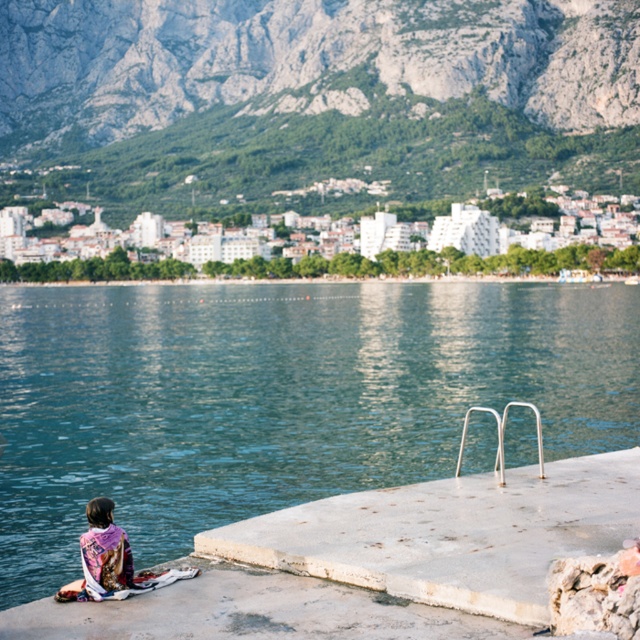
Question: Does teal concrete water at lower left have a larger size compared to gray rocky mountain at upper center?

Choices:
 (A) yes
 (B) no

Answer: (B)

Question: Can you confirm if teal concrete water at lower left is bigger than gray rocky mountain at upper center?

Choices:
 (A) no
 (B) yes

Answer: (A)

Question: Which point is closer to the camera?

Choices:
 (A) teal concrete water at lower left
 (B) gray rocky mountain at upper center

Answer: (A)

Question: Which object appears closest to the camera in this image?

Choices:
 (A) printed fabric scarf at lower left
 (B) gray rocky mountain at upper center

Answer: (A)

Question: Which object appears closest to the camera in this image?

Choices:
 (A) teal concrete water at lower left
 (B) gray rocky mountain at upper center

Answer: (A)

Question: Does teal concrete water at lower left appear on the left side of gray rocky mountain at upper center?

Choices:
 (A) no
 (B) yes

Answer: (A)